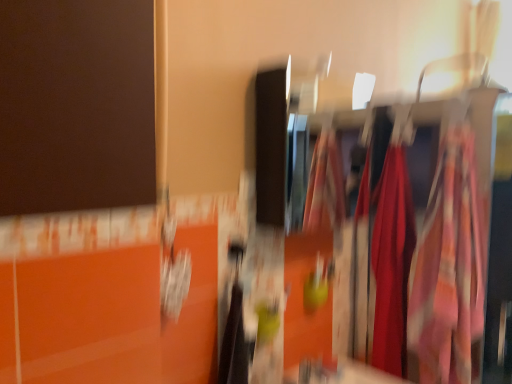
Question: Should I look upward or downward to see silky fabric dress at right?

Choices:
 (A) up
 (B) down

Answer: (B)

Question: Is floral fabric dress at right, the 2th clothing in the back-to-front sequence, closer to camera compared to silky red fabric at center, positioned as the second clothing in front-to-back order?

Choices:
 (A) no
 (B) yes

Answer: (B)

Question: Does floral fabric dress at right, the 2th clothing in the back-to-front sequence, have a greater height compared to silky red fabric at center, marked as the 1th clothing in a back-to-front arrangement?

Choices:
 (A) yes
 (B) no

Answer: (B)

Question: Can you confirm if floral fabric dress at right, the 1th clothing when ordered from front to back, is wider than silky red fabric at center, marked as the 1th clothing in a back-to-front arrangement?

Choices:
 (A) yes
 (B) no

Answer: (A)

Question: Is floral fabric dress at right, the 1th clothing when ordered from front to back, not close to silky red fabric at center, positioned as the second clothing in front-to-back order?

Choices:
 (A) no
 (B) yes

Answer: (A)

Question: Is floral fabric dress at right, the 1th clothing when ordered from front to back, thinner than silky red fabric at center, marked as the 1th clothing in a back-to-front arrangement?

Choices:
 (A) yes
 (B) no

Answer: (B)

Question: Is floral fabric dress at right, the 1th clothing when ordered from front to back, to the left of silky red fabric at center, marked as the 1th clothing in a back-to-front arrangement, from the viewer's perspective?

Choices:
 (A) no
 (B) yes

Answer: (A)

Question: Is the depth of floral fabric dress at right, the 2th clothing in the back-to-front sequence, greater than that of silky fabric dress at right?

Choices:
 (A) yes
 (B) no

Answer: (A)

Question: Is floral fabric dress at right, the 1th clothing when ordered from front to back, shorter than silky fabric dress at right?

Choices:
 (A) no
 (B) yes

Answer: (B)

Question: From the image's perspective, would you say floral fabric dress at right, the 2th clothing in the back-to-front sequence, is positioned over silky fabric dress at right?

Choices:
 (A) yes
 (B) no

Answer: (A)

Question: Is floral fabric dress at right, the 1th clothing when ordered from front to back, aimed at silky fabric dress at right?

Choices:
 (A) yes
 (B) no

Answer: (B)

Question: Is floral fabric dress at right, the 2th clothing in the back-to-front sequence, positioned with its back to silky fabric dress at right?

Choices:
 (A) no
 (B) yes

Answer: (A)

Question: Is floral fabric dress at right, the 2th clothing in the back-to-front sequence, in contact with silky fabric dress at right?

Choices:
 (A) no
 (B) yes

Answer: (A)

Question: Is silky red fabric at center, positioned as the second clothing in front-to-back order, looking in the opposite direction of silky fabric dress at right?

Choices:
 (A) no
 (B) yes

Answer: (B)